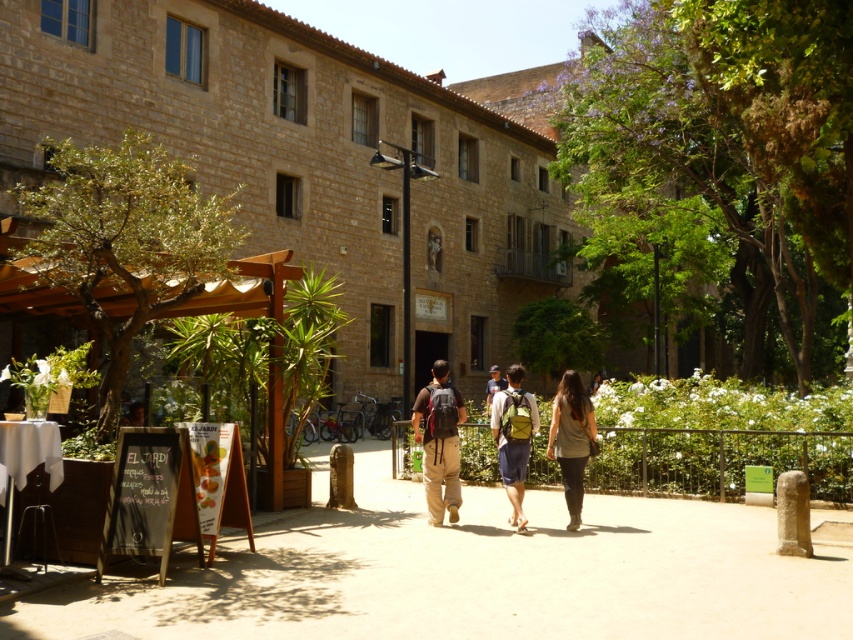
Does dark olive-green fabric at center lie behind green fabric backpack at center?

Yes.

Which is behind, point (569, 449) or point (509, 392)?

The point (509, 392) is behind.

Is point (566, 416) in front of point (506, 468)?

Yes, it is in front of point (506, 468).

The width and height of the screenshot is (853, 640). Find the location of `dark olive-green fabric at center`. dark olive-green fabric at center is located at coordinates (572, 440).

Which is above, matte brown backpack at center or green fabric backpack at center?

matte brown backpack at center

This screenshot has width=853, height=640. I want to click on matte brown backpack at center, so click(x=439, y=442).

Is point (573, 492) positioned after point (495, 387)?

That is False.

Which is more to the left, dark olive-green fabric at center or light brown backpack at center?

dark olive-green fabric at center

Is point (566, 394) positioned after point (498, 369)?

No, it is in front of (498, 369).

At what (x,y) coordinates should I click in order to perform the action: click on dark olive-green fabric at center. Please return your answer as a coordinate pair (x, y). Looking at the image, I should click on (572, 440).